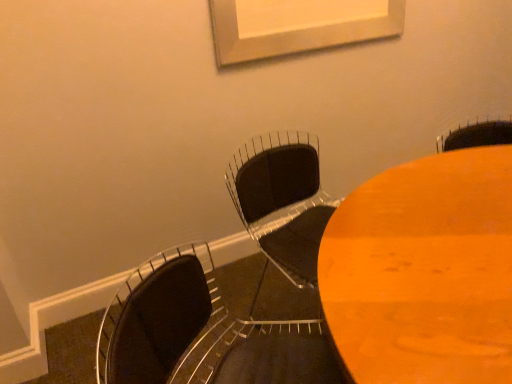
Question: Does black matte chair at center, positioned as the first chair in back-to-front order, have a greater height compared to wooden table at center?

Choices:
 (A) yes
 (B) no

Answer: (B)

Question: From a real-world perspective, is black matte chair at center, positioned as the first chair in back-to-front order, over wooden table at center?

Choices:
 (A) no
 (B) yes

Answer: (B)

Question: Is the position of black matte chair at center, positioned as the 2th chair in front-to-back order, more distant than that of wooden table at center?

Choices:
 (A) yes
 (B) no

Answer: (A)

Question: Does black matte chair at center, positioned as the first chair in back-to-front order, turn towards wooden table at center?

Choices:
 (A) no
 (B) yes

Answer: (B)

Question: Would you say black matte chair at center, positioned as the 2th chair in front-to-back order, is outside wooden table at center?

Choices:
 (A) yes
 (B) no

Answer: (A)

Question: Is black matte chair at center, positioned as the first chair in back-to-front order, placed right next to wooden table at center?

Choices:
 (A) yes
 (B) no

Answer: (B)

Question: Is wooden table at center with black matte chair at center, positioned as the first chair in back-to-front order?

Choices:
 (A) yes
 (B) no

Answer: (B)

Question: Is wooden table at center taller than black matte chair at center, positioned as the 2th chair in front-to-back order?

Choices:
 (A) yes
 (B) no

Answer: (A)

Question: From the image's perspective, is wooden table at center located above black matte chair at center, positioned as the 2th chair in front-to-back order?

Choices:
 (A) no
 (B) yes

Answer: (A)

Question: Can you confirm if wooden table at center is shorter than black matte chair at center, positioned as the first chair in back-to-front order?

Choices:
 (A) yes
 (B) no

Answer: (B)

Question: Can you confirm if wooden table at center is smaller than black matte chair at center, positioned as the 2th chair in front-to-back order?

Choices:
 (A) yes
 (B) no

Answer: (B)

Question: Does wooden table at center contain black matte chair at center, positioned as the 2th chair in front-to-back order?

Choices:
 (A) yes
 (B) no

Answer: (B)

Question: Can you confirm if wooden table at center is shorter than matte black chair at lower left, the 2th chair viewed from the back?

Choices:
 (A) yes
 (B) no

Answer: (B)